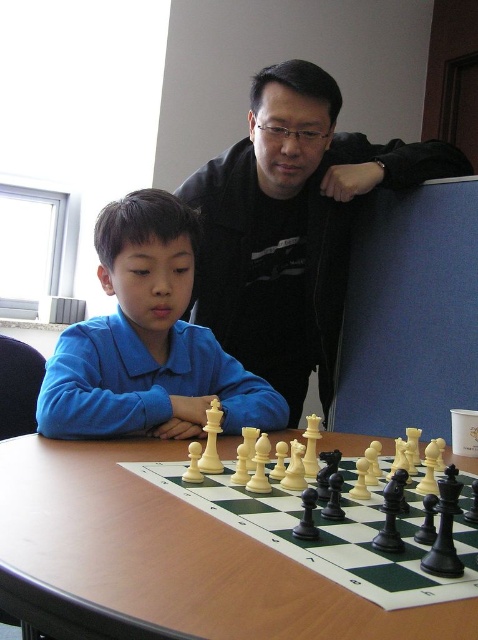
Question: Which point is closer to the camera taking this photo?

Choices:
 (A) (156, 550)
 (B) (294, 124)
 (C) (210, 337)

Answer: (A)

Question: Does wooden table at center have a larger size compared to black matte jacket at upper center?

Choices:
 (A) yes
 (B) no

Answer: (B)

Question: Which of these objects is positioned closest to the blue cotton shirt at center?

Choices:
 (A) wooden table at center
 (B) black matte jacket at upper center

Answer: (A)

Question: Is wooden table at center in front of blue cotton shirt at center?

Choices:
 (A) yes
 (B) no

Answer: (A)

Question: Observing the image, what is the correct spatial positioning of black matte jacket at upper center in reference to blue cotton shirt at center?

Choices:
 (A) above
 (B) below

Answer: (A)

Question: Among these objects, which one is farthest from the camera?

Choices:
 (A) blue cotton shirt at center
 (B) black matte jacket at upper center

Answer: (B)